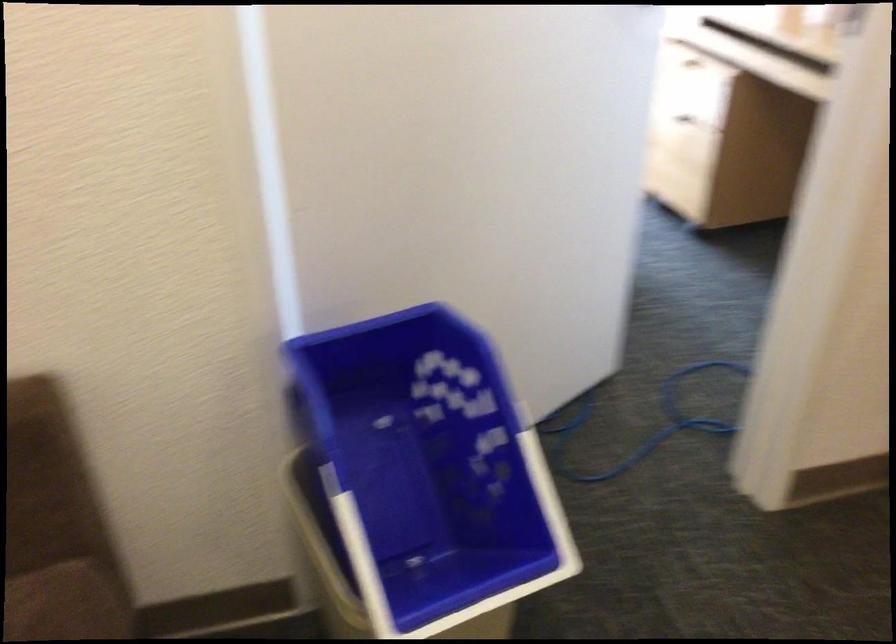
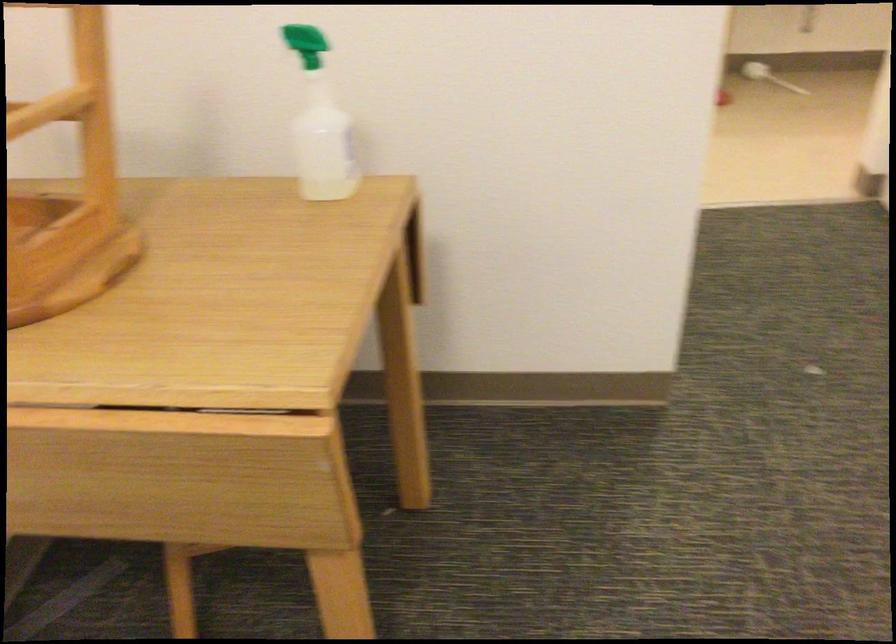
Question: The camera is either moving clockwise (left) or counter-clockwise (right) around the object. The first image is from the beginning of the video and the second image is from the end. Is the camera moving left or right when shooting the video?

Choices:
 (A) Left
 (B) Right

Answer: (A)